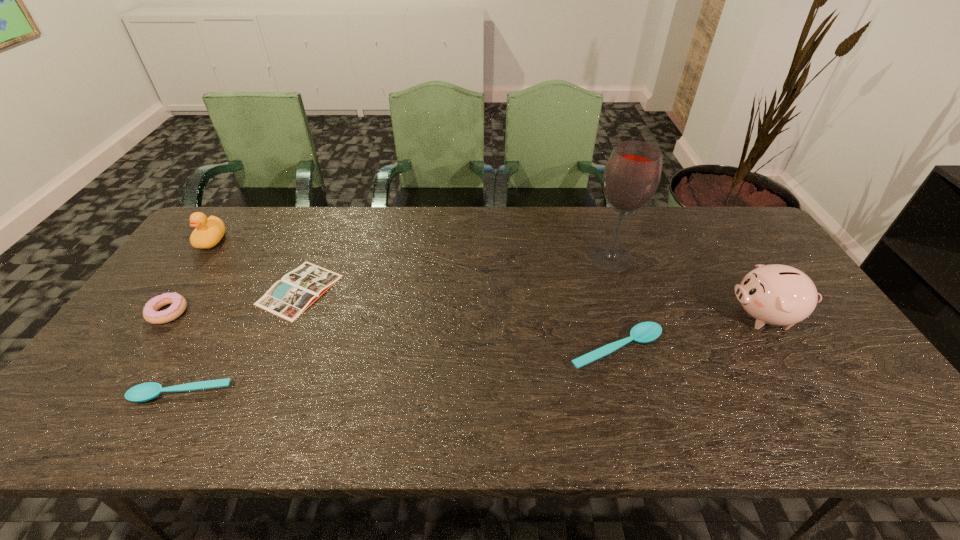
Locate an element on the screen. vacant region that satisfies the following two spatial constraints: 1. on the face of the fifth shortest object; 2. on the left side of the farther spoon is located at coordinates (133, 349).

Find the location of a particular element. vacant position in the image that satisfies the following two spatial constraints: 1. on the face of the second tallest object; 2. on the left side of the fifth shortest object is located at coordinates (157, 316).

Find the location of a particular element. The width and height of the screenshot is (960, 540). free space that satisfies the following two spatial constraints: 1. on the face of the third tallest object; 2. on the right side of the nearest object is located at coordinates (102, 394).

I want to click on vacant area that satisfies the following two spatial constraints: 1. on the face of the tallest object; 2. on the right side of the fifth shortest object, so (199, 258).

Where is `vacant space that satisfies the following two spatial constraints: 1. on the face of the third shortest object; 2. on the left side of the third tallest object`? This screenshot has height=540, width=960. vacant space that satisfies the following two spatial constraints: 1. on the face of the third shortest object; 2. on the left side of the third tallest object is located at coordinates (133, 349).

Locate an element on the screen. The image size is (960, 540). free point that satisfies the following two spatial constraints: 1. on the face of the fifth shortest object; 2. on the right side of the rightmost object is located at coordinates (157, 316).

Where is `free location that satisfies the following two spatial constraints: 1. on the face of the fifth shortest object; 2. on the right side of the piggy bank`? The image size is (960, 540). free location that satisfies the following two spatial constraints: 1. on the face of the fifth shortest object; 2. on the right side of the piggy bank is located at coordinates (157, 316).

At what (x,y) coordinates should I click in order to perform the action: click on free space that satisfies the following two spatial constraints: 1. on the face of the fifth shortest object; 2. on the right side of the piggy bank. Please return your answer as a coordinate pair (x, y). Looking at the image, I should click on tap(157, 316).